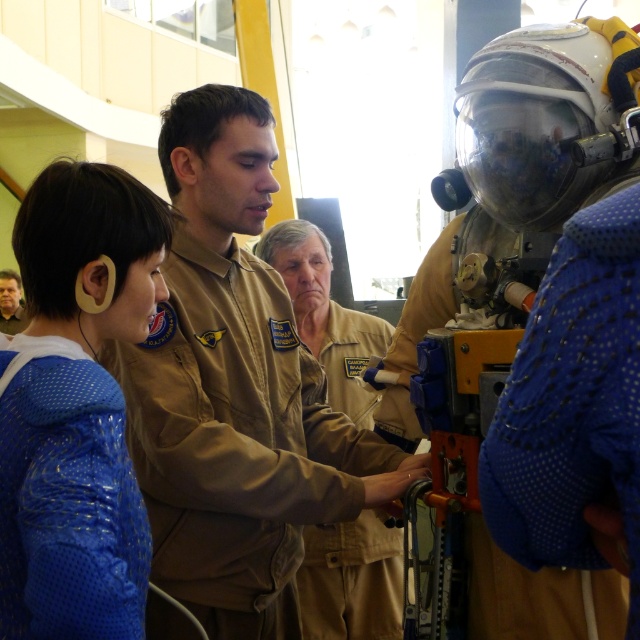
From the picture: Does tan uniform at center have a greater width compared to blue mesh jacket at left?

Yes.

Does tan uniform at center appear over blue mesh jacket at left?

Yes.

Between point (294, 506) and point (6, 493), which one is positioned behind?

The point (294, 506) is behind.

Where is `tan uniform at center`? tan uniform at center is located at coordinates (244, 404).

Who is more forward, (10,580) or (333,582)?

Positioned in front is point (10,580).

Between point (77, 472) and point (310, 540), which one is positioned behind?

Positioned behind is point (310, 540).

The image size is (640, 640). Find the location of `blue mesh jacket at left`. blue mesh jacket at left is located at coordinates (68, 504).

Who is more forward, (385, 634) or (13, 314)?

Point (385, 634) is more forward.

Which is below, tan/khaki fabric uniform at center or brown leather jacket at lower left?

tan/khaki fabric uniform at center is below.

What do you see at coordinates (352, 580) in the screenshot? I see `tan/khaki fabric uniform at center` at bounding box center [352, 580].

This screenshot has height=640, width=640. In order to click on tan/khaki fabric uniform at center in this screenshot , I will do `click(352, 580)`.